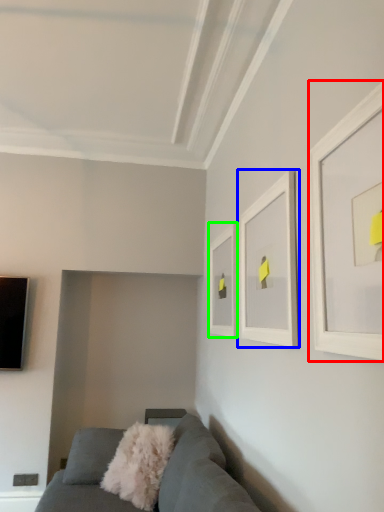
Question: Which object is positioned farthest from picture frame (highlighted by a red box)? Select from picture frame (highlighted by a blue box) and picture frame (highlighted by a green box).

Choices:
 (A) picture frame
 (B) picture frame

Answer: (B)